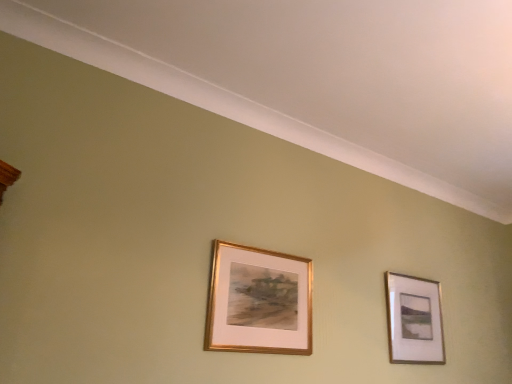
Question: Looking at the image, does gold metallic picture frame at upper right, arranged as the second picture frame when viewed from the front, seem bigger or smaller compared to gold metallic frame at center, marked as the second picture frame in a right-to-left arrangement?

Choices:
 (A) small
 (B) big

Answer: (B)

Question: From a real-world perspective, relative to gold metallic frame at center, marked as the second picture frame in a right-to-left arrangement, is gold metallic picture frame at upper right, the 1th picture frame positioned from the right, vertically above or below?

Choices:
 (A) above
 (B) below

Answer: (A)

Question: In the image, is gold metallic picture frame at upper right, arranged as the 2th picture frame when viewed from the left, positioned in front of or behind gold metallic frame at center, placed as the first picture frame when sorted from front to back?

Choices:
 (A) front
 (B) behind

Answer: (B)

Question: Considering the positions of gold metallic frame at center, marked as the second picture frame in a right-to-left arrangement, and gold metallic picture frame at upper right, the 1th picture frame positioned from the right, in the image, is gold metallic frame at center, marked as the second picture frame in a right-to-left arrangement, wider or thinner than gold metallic picture frame at upper right, the 1th picture frame positioned from the right,?

Choices:
 (A) wide
 (B) thin

Answer: (B)

Question: Is gold metallic frame at center, placed as the first picture frame when sorted from front to back, taller or shorter than gold metallic picture frame at upper right, arranged as the 2th picture frame when viewed from the left?

Choices:
 (A) tall
 (B) short

Answer: (B)

Question: Is gold metallic frame at center, marked as the second picture frame in a right-to-left arrangement, situated inside gold metallic picture frame at upper right, the 1th picture frame positioned from the right, or outside?

Choices:
 (A) outside
 (B) inside

Answer: (A)

Question: From the image's perspective, is gold metallic frame at center, marked as the second picture frame in a right-to-left arrangement, above or below gold metallic picture frame at upper right, arranged as the 2th picture frame when viewed from the left?

Choices:
 (A) above
 (B) below

Answer: (A)